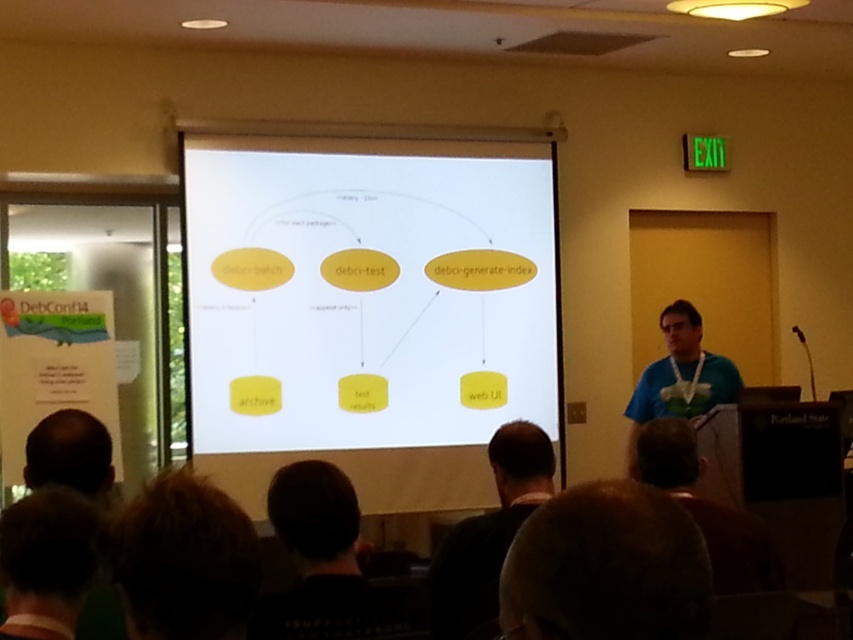
You are an attendee in the conference room and want to focus on the yellow matte diagram at center while also checking the dark brown hair at lower center. Can you do both without moving your head?

The yellow matte diagram at center is located above dark brown hair at lower center, so you can focus on both by adjusting your gaze upwards for the diagram and downwards for the hair without moving your head.